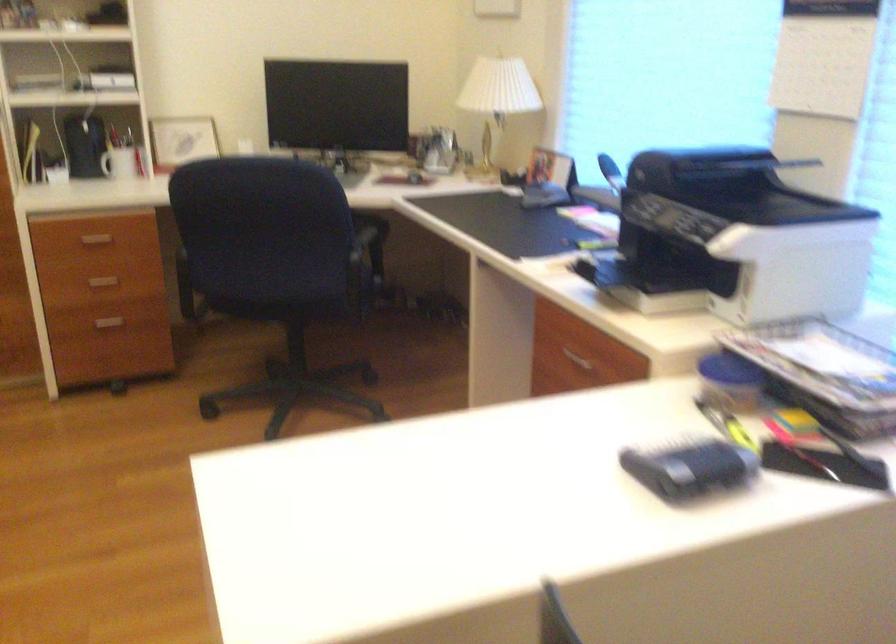
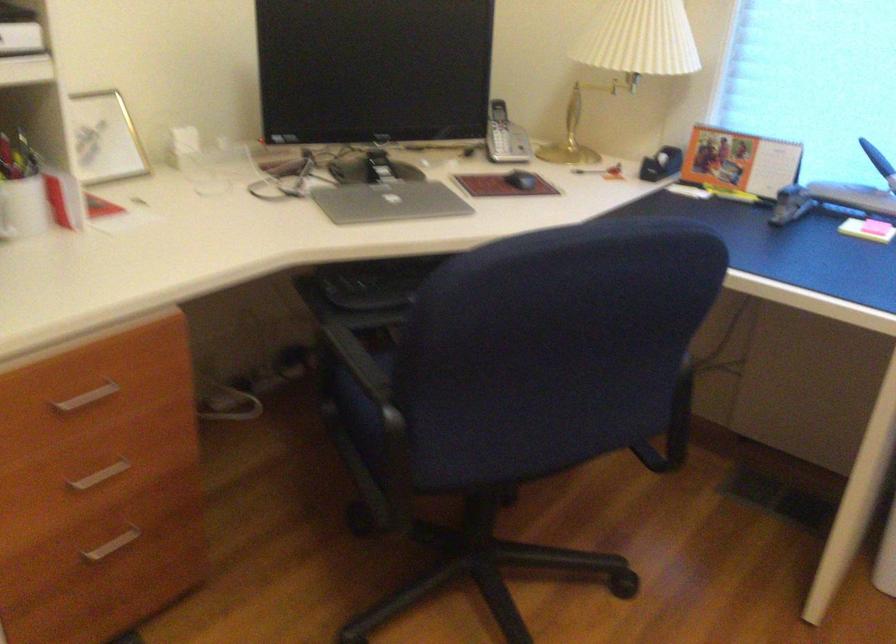
Find the pixel in the second image that matches [108,158] in the first image.

(23, 207)